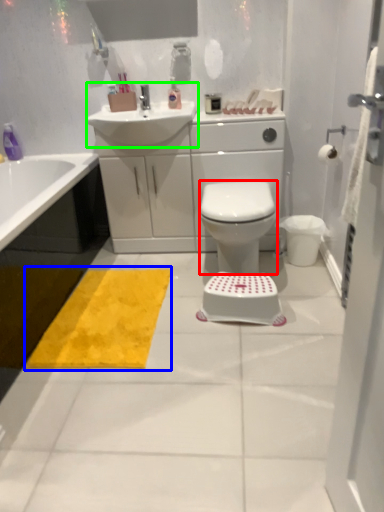
Question: Estimate the real-world distances between objects in this image. Which object is closer to bidet (highlighted by a red box), doormat (highlighted by a blue box) or sink (highlighted by a green box)?

Choices:
 (A) doormat
 (B) sink

Answer: (A)